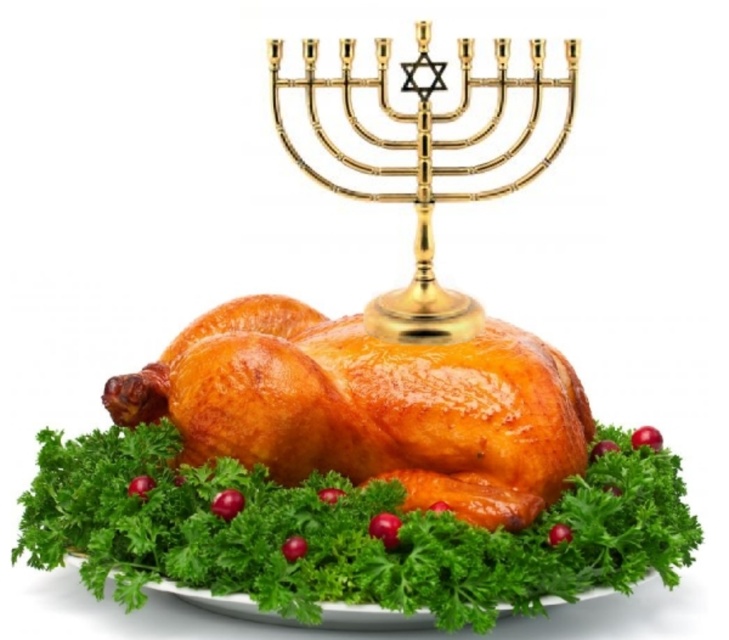
Between golden crispy turkey at center and gold polished menorah at upper center, which one has less height?

golden crispy turkey at center

Between point (276, 452) and point (391, 202), which one is positioned behind?

Positioned behind is point (391, 202).

The height and width of the screenshot is (640, 729). I want to click on golden crispy turkey at center, so click(x=354, y=474).